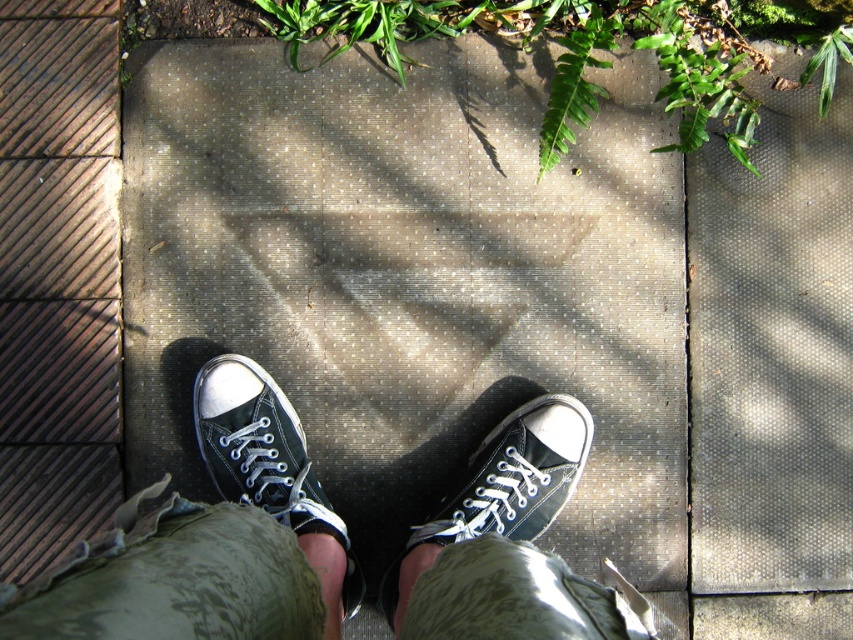
Is point (47, 605) less distant than point (579, 465)?

Yes, point (47, 605) is closer to viewer.

Who is shorter, black canvas shoes at center or black canvas shoe at center?

black canvas shoe at center is shorter.

Is point (178, 561) in front of point (439, 545)?

That is True.

Where is `black canvas shoes at center`? The height and width of the screenshot is (640, 853). black canvas shoes at center is located at coordinates (210, 540).

Does matte black sneaker at center have a greater width compared to black canvas shoe at center?

In fact, matte black sneaker at center might be narrower than black canvas shoe at center.

Between matte black sneaker at center and black canvas shoe at center, which one is positioned lower?

black canvas shoe at center is below.

This screenshot has height=640, width=853. What do you see at coordinates (271, 470) in the screenshot?
I see `matte black sneaker at center` at bounding box center [271, 470].

What are the coordinates of `matte black sneaker at center` in the screenshot? It's located at (271, 470).

Who is higher up, black canvas shoes at center or matte black sneaker at center?

matte black sneaker at center

Between point (537, 419) and point (268, 424), which one is positioned in front?

Point (268, 424) is in front.

The height and width of the screenshot is (640, 853). What do you see at coordinates (210, 540) in the screenshot?
I see `black canvas shoes at center` at bounding box center [210, 540].

Identify the location of black canvas shoes at center. This screenshot has width=853, height=640. (210, 540).